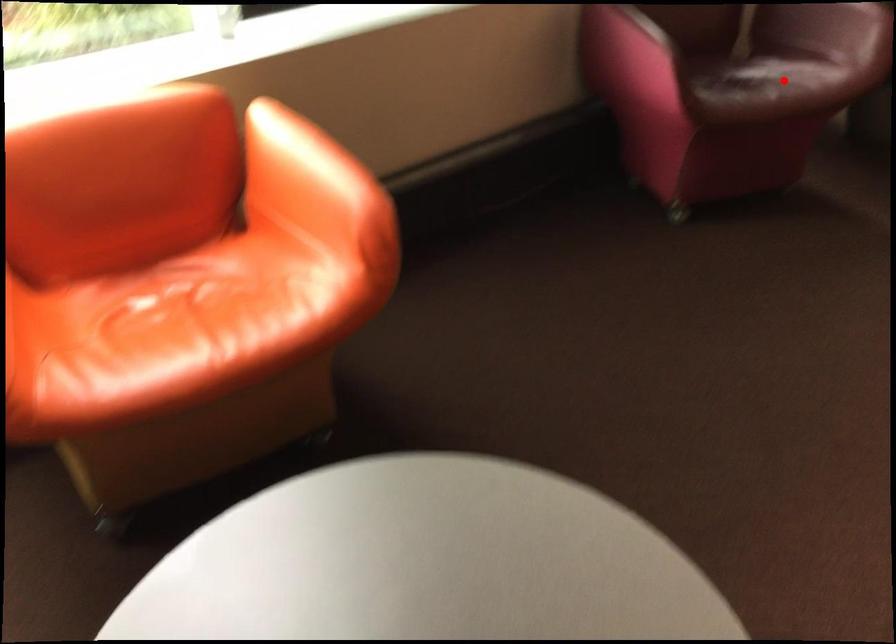
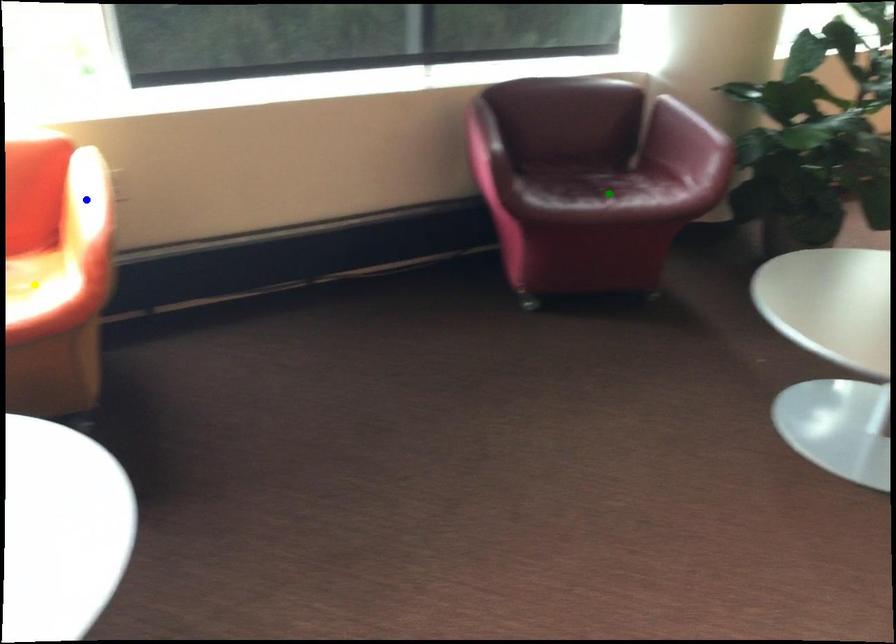
Question: I am providing you with two images of the same scene from different viewpoints. A red point is marked on the first image. You are given multiple points on the second image. Which mark in image 2 goes with the point in image 1?

Choices:
 (A) yellow point
 (B) green point
 (C) blue point

Answer: (B)